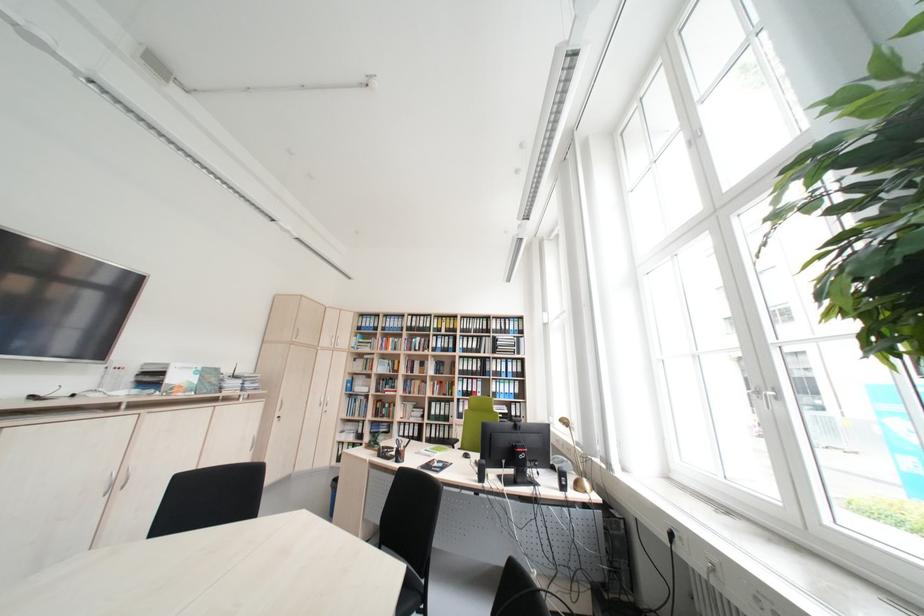
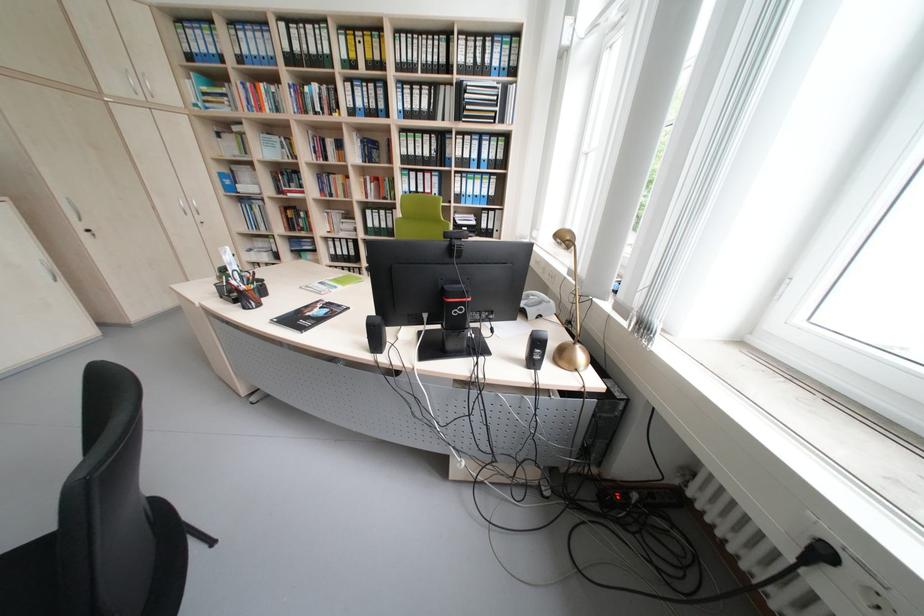
Locate, in the second image, the point that corresponds to the point at 388,385 in the first image.

(286, 182)